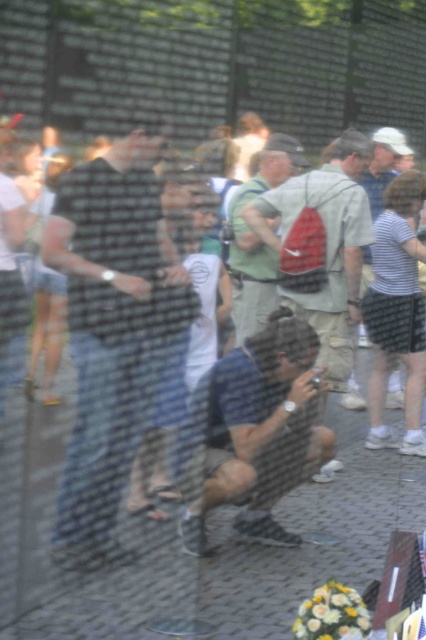
You are standing in front of a memorial wall and see a person wearing a dark plaid shirt at center and a red backpack at center. Which object is taller?

The dark plaid shirt at center is taller than the red backpack at center.

You are standing in the memorial area and see a person wearing a dark plaid shirt at center and carrying a green fabric backpack at center. Which item is closer to you?

The dark plaid shirt at center is closer to you because it is in front of the green fabric backpack at center.